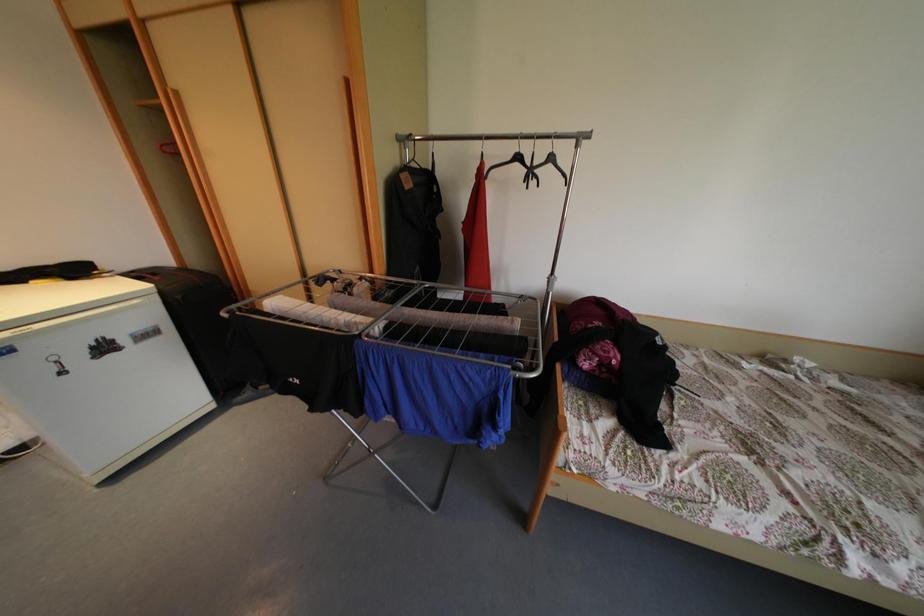
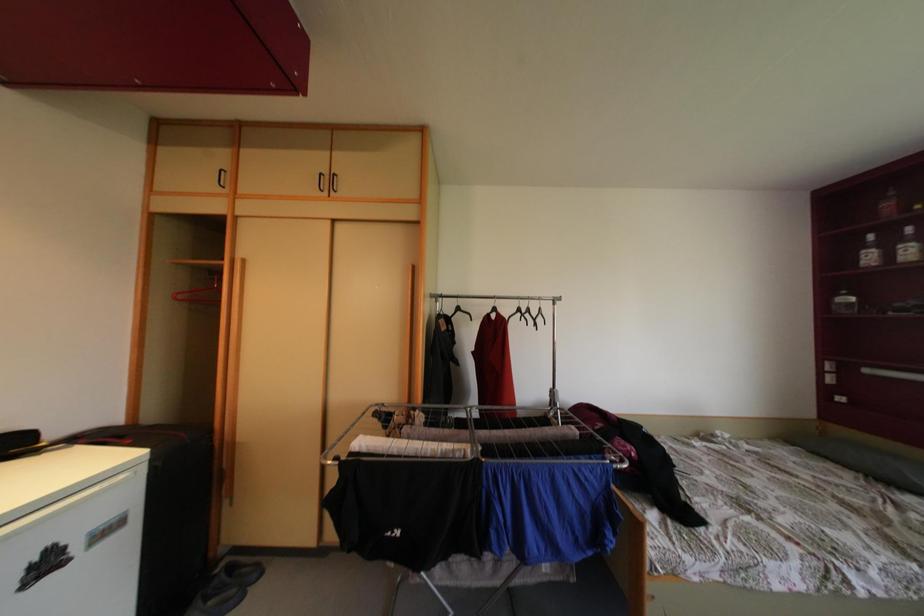
How did the camera likely rotate?

The camera rotated toward right-up.